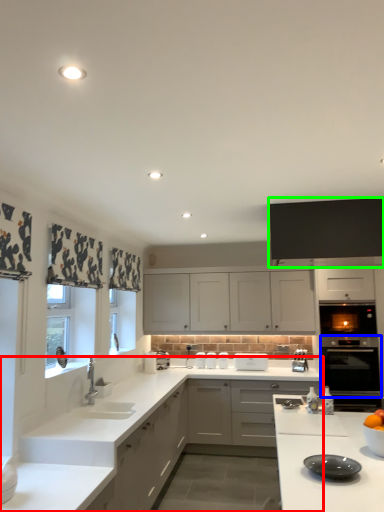
Question: Based on their relative distances, which object is nearer to countertop (highlighted by a red box)? Choose from oven (highlighted by a blue box) and cabinetry (highlighted by a green box).

Choices:
 (A) oven
 (B) cabinetry

Answer: (B)